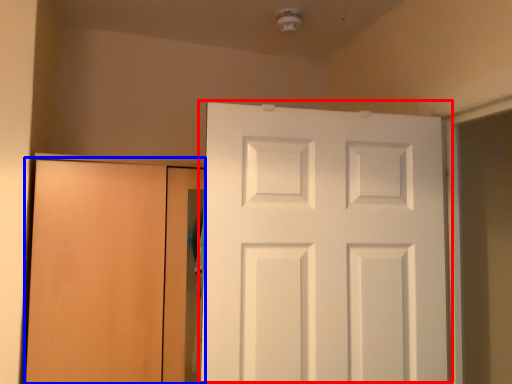
Question: Which object is closer to the camera taking this photo, door (highlighted by a red box) or door (highlighted by a blue box)?

Choices:
 (A) door
 (B) door

Answer: (A)